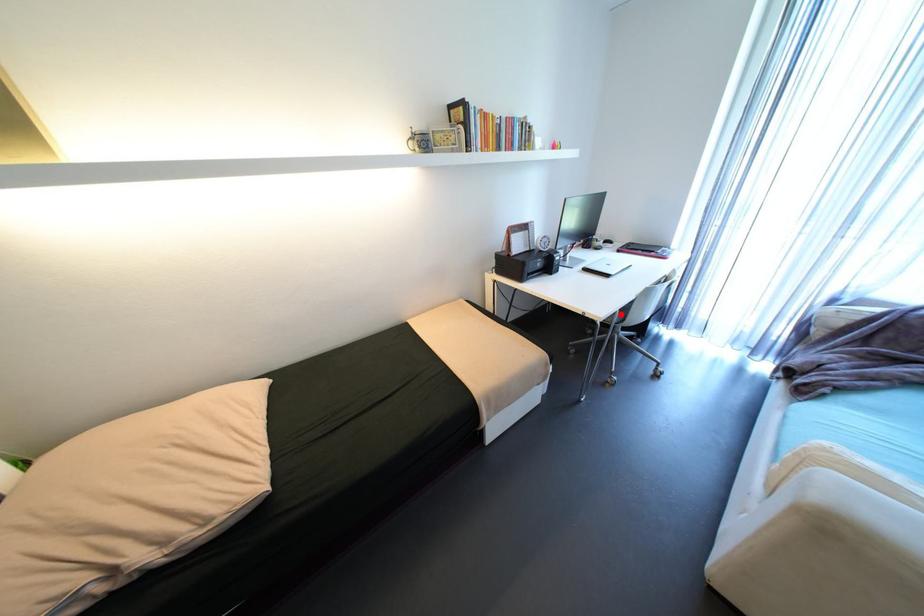
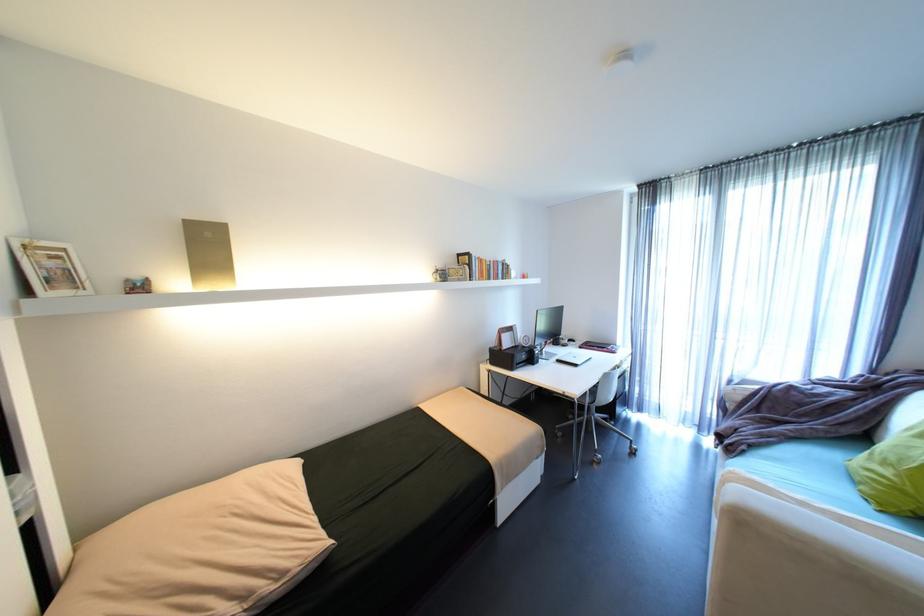
In the second image, find the point that corresponds to the highlighted location in the first image.

(592, 394)